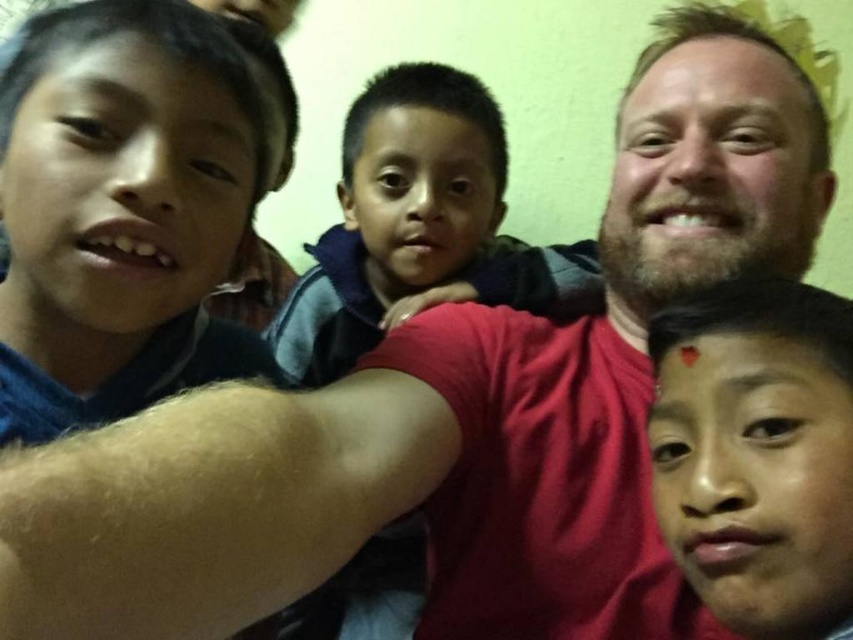
Question: Is dark blue fleece at center closer to the viewer compared to matte skin face at lower right?

Choices:
 (A) yes
 (B) no

Answer: (B)

Question: Among these points, which one is nearest to the camera?

Choices:
 (A) (816, 492)
 (B) (357, 563)

Answer: (A)

Question: Does dark blue fleece at center come in front of matte skin face at lower right?

Choices:
 (A) yes
 (B) no

Answer: (B)

Question: Among these objects, which one is farthest from the camera?

Choices:
 (A) matte skin face at lower right
 (B) dark blue fleece at center

Answer: (B)

Question: Does dark blue fleece at center appear under matte skin face at lower right?

Choices:
 (A) yes
 (B) no

Answer: (B)